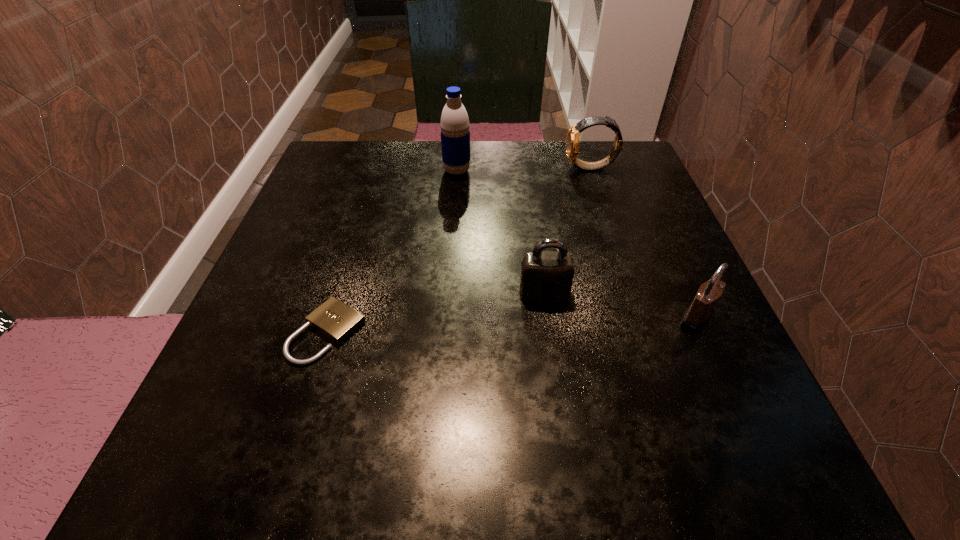
The width and height of the screenshot is (960, 540). Identify the location of free region at the far edge. (536, 166).

The image size is (960, 540). In the image, there is a desktop. Find the location of `vacant area at the near edge`. vacant area at the near edge is located at coordinates (641, 443).

At what (x,y) coordinates should I click in order to perform the action: click on vacant space at the left edge of the desktop. Please return your answer as a coordinate pair (x, y). Looking at the image, I should click on (275, 339).

Where is `vacant region at the right edge of the desktop`? Image resolution: width=960 pixels, height=540 pixels. vacant region at the right edge of the desktop is located at coordinates (652, 278).

This screenshot has height=540, width=960. In the image, there is a desktop. In order to click on vacant space at the far left corner in this screenshot , I will do `click(334, 145)`.

What are the coordinates of `vacant space at the near left corner of the desktop` in the screenshot? It's located at (238, 461).

Where is `blank space at the far right corner`? Image resolution: width=960 pixels, height=540 pixels. blank space at the far right corner is located at coordinates tap(604, 144).

In order to click on vacant space at the near right corner of the desktop in this screenshot , I will do `click(667, 454)`.

Identify the location of blank region between the second padlock from right to left and the rightmost padlock. The height and width of the screenshot is (540, 960). (620, 305).

The image size is (960, 540). What are the coordinates of `free space between the rightmost padlock and the third object from left to right` in the screenshot? It's located at (620, 305).